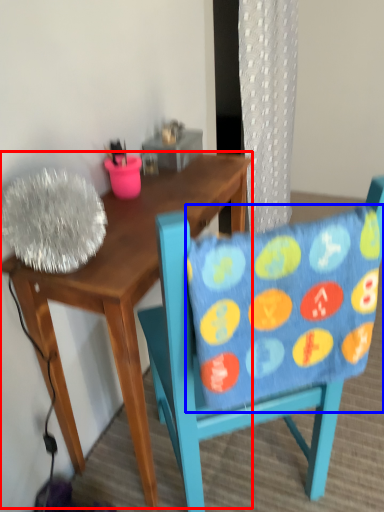
Question: Which of the following is the farthest to the observer, desk (highlighted by a red box) or pillow (highlighted by a blue box)?

Choices:
 (A) desk
 (B) pillow

Answer: (A)